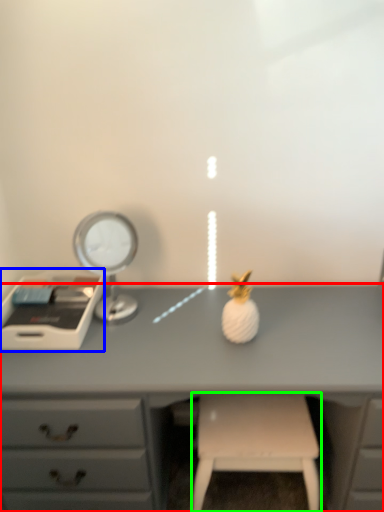
Question: Estimate the real-world distances between objects in this image. Which object is farther from desk (highlighted by a red box), writing desk (highlighted by a blue box) or stool (highlighted by a green box)?

Choices:
 (A) writing desk
 (B) stool

Answer: (A)